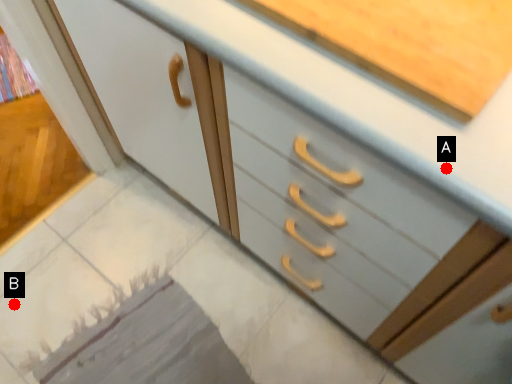
Question: Two points are circled on the image, labeled by A and B beside each circle. Which point is farther to the camera?

Choices:
 (A) A is further
 (B) B is further

Answer: (B)